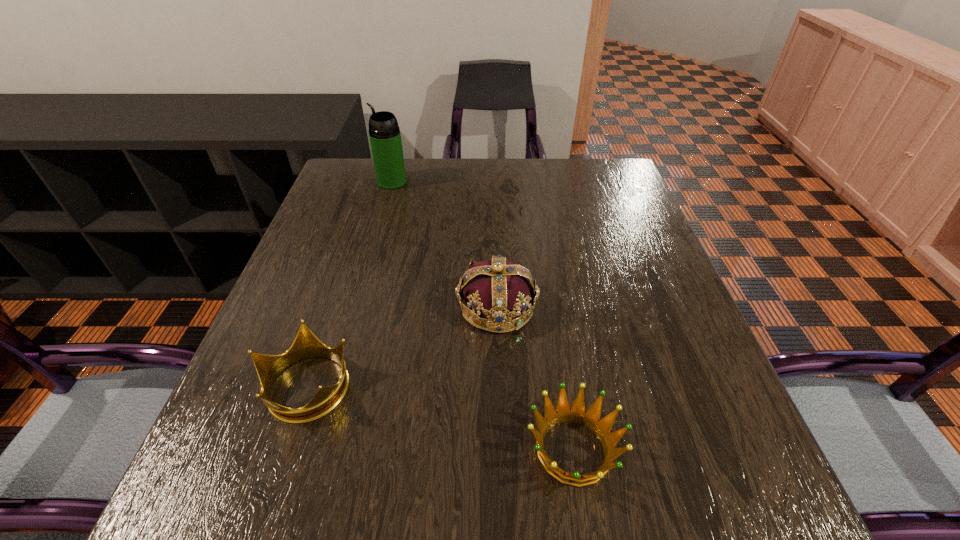
Where is `vacant space situated on the left of the second tallest object`? vacant space situated on the left of the second tallest object is located at coordinates (380, 307).

I want to click on free space located on the back of the leftmost crown, so [348, 259].

Locate an element on the screen. free space located 0.140m on the right of the shortest crown is located at coordinates (708, 450).

This screenshot has width=960, height=540. What are the coordinates of `object at the far edge` in the screenshot? It's located at (384, 133).

Locate an element on the screen. Image resolution: width=960 pixels, height=540 pixels. object situated at the near edge is located at coordinates (577, 413).

You are a GUI agent. You are given a task and a screenshot of the screen. Output one action in this format:
    pyautogui.click(x=<x>, y=<y>)
    Task: Click on the thermos bottle that is at the left edge
    The height and width of the screenshot is (540, 960).
    Given the screenshot: What is the action you would take?
    pyautogui.click(x=384, y=133)

Find the location of a particular element. crown that is at the left edge is located at coordinates [x=306, y=345].

I want to click on object that is at the far left corner, so click(x=384, y=133).

At what (x,y) coordinates should I click in order to perform the action: click on free space at the far edge of the desktop. Please return your answer as a coordinate pair (x, y). The height and width of the screenshot is (540, 960). Looking at the image, I should click on (423, 168).

This screenshot has width=960, height=540. What are the coordinates of `vacant region at the near edge` in the screenshot? It's located at (398, 512).